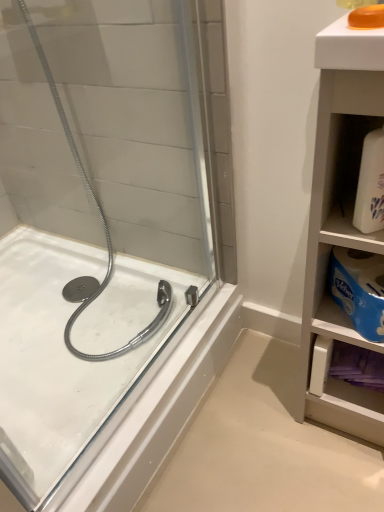
Question: Would you say translucent orange soap at upper right is outside white matte bottle at right?

Choices:
 (A) no
 (B) yes

Answer: (B)

Question: Is translucent orange soap at upper right to the left of white matte bottle at right from the viewer's perspective?

Choices:
 (A) yes
 (B) no

Answer: (A)

Question: Is white matte bottle at right a part of translucent orange soap at upper right?

Choices:
 (A) no
 (B) yes

Answer: (A)

Question: Are translucent orange soap at upper right and white matte bottle at right beside each other?

Choices:
 (A) no
 (B) yes

Answer: (A)

Question: Considering the relative sizes of translucent orange soap at upper right and white matte bottle at right in the image provided, is translucent orange soap at upper right shorter than white matte bottle at right?

Choices:
 (A) yes
 (B) no

Answer: (A)

Question: From the image's perspective, would you say translucent orange soap at upper right is shown under white matte bottle at right?

Choices:
 (A) no
 (B) yes

Answer: (A)

Question: Considering the relative sizes of white matte cabinet at right and white glossy bath at left in the image provided, is white matte cabinet at right smaller than white glossy bath at left?

Choices:
 (A) yes
 (B) no

Answer: (A)

Question: From a real-world perspective, is white matte cabinet at right on white glossy bath at left?

Choices:
 (A) yes
 (B) no

Answer: (A)

Question: Does white matte cabinet at right appear on the right side of white glossy bath at left?

Choices:
 (A) no
 (B) yes

Answer: (B)

Question: Is white matte cabinet at right at the left side of white glossy bath at left?

Choices:
 (A) yes
 (B) no

Answer: (B)

Question: From a real-world perspective, is white matte cabinet at right below white glossy bath at left?

Choices:
 (A) yes
 (B) no

Answer: (B)

Question: Does white matte cabinet at right have a greater height compared to white glossy bath at left?

Choices:
 (A) yes
 (B) no

Answer: (A)

Question: Considering the relative positions of translucent orange soap at upper right and white glossy bath at left in the image provided, is translucent orange soap at upper right to the left of white glossy bath at left from the viewer's perspective?

Choices:
 (A) yes
 (B) no

Answer: (B)